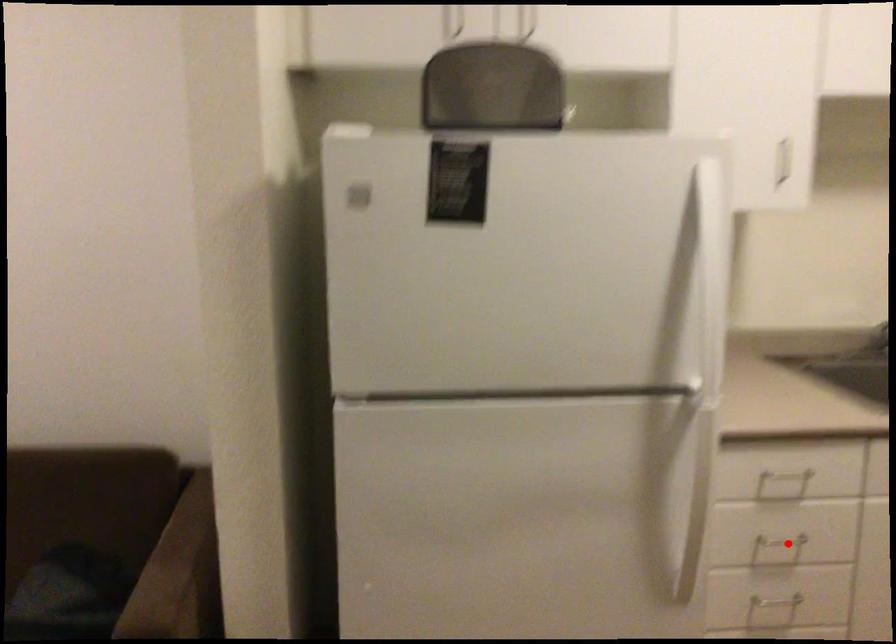
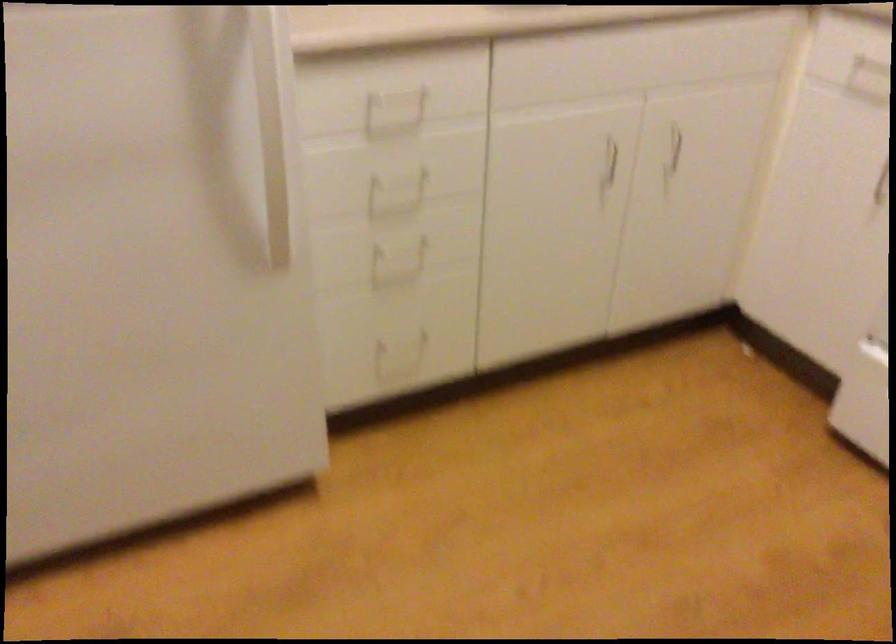
The point at the highlighted location is marked in the first image. Where is the corresponding point in the second image?

(405, 178)